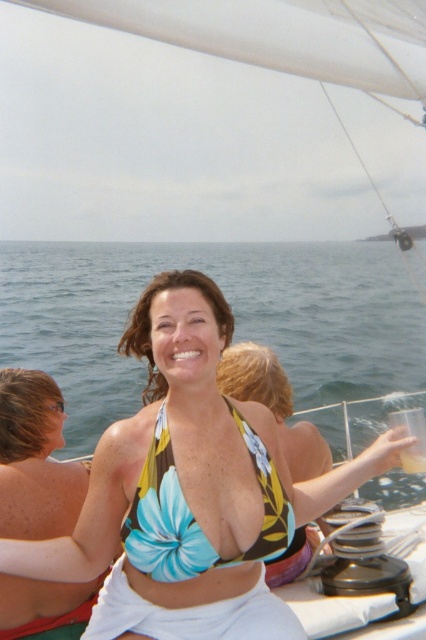
You are a photographer on the boat and want to capture a clear shot of the blue floral bikini top at center without the clear blue water at center obstructing it. How can you adjust your position or angle to achieve this?

To avoid the clear blue water at center obstructing the blue floral bikini top at center, you can lower your camera angle or move closer to the subject so that the blue floral bikini top at center is framed above the clear blue water at center.

You are a photographer on the boat and want to capture a photo where both the matte skin at upper left and the blue floral bikini top at center are clearly visible. Based on their heights, which object might appear larger in the photo?

The matte skin at upper left has a greater height compared to the blue floral bikini top at center, so it might appear larger in the photo.